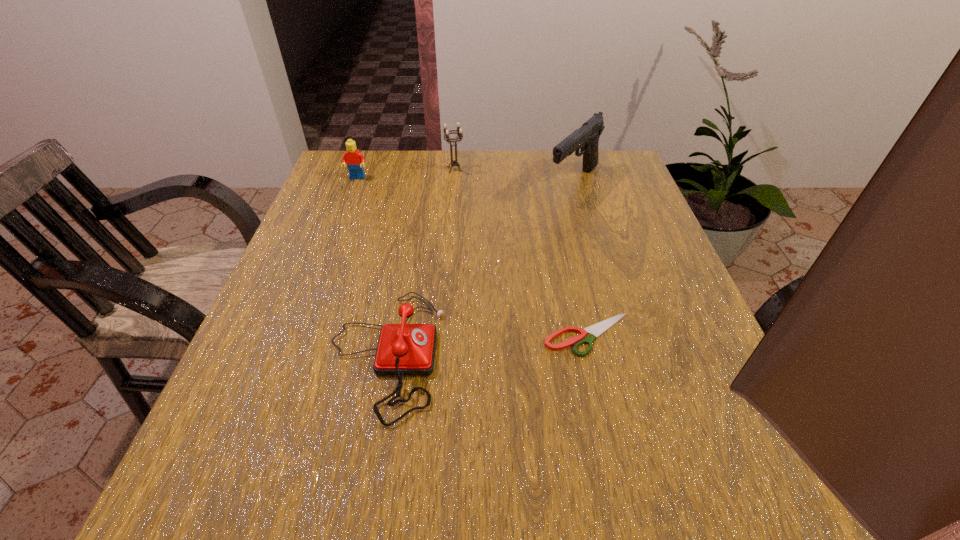
Image resolution: width=960 pixels, height=540 pixels. What are the coordinates of `vacant space at the far edge` in the screenshot? It's located at (431, 170).

Where is `blank space at the near edge of the desktop`? blank space at the near edge of the desktop is located at coordinates (563, 459).

Locate an element on the screen. The image size is (960, 540). free spot at the left edge of the desktop is located at coordinates (354, 227).

What are the coordinates of `vacant region at the right edge of the desktop` in the screenshot? It's located at (625, 352).

Locate an element on the screen. free spot between the third tallest object and the gun is located at coordinates (466, 180).

This screenshot has height=540, width=960. Identify the location of free point between the leftmost object and the gun. (466, 180).

The image size is (960, 540). I want to click on vacant space that is in between the scissors and the Lego, so click(x=472, y=256).

This screenshot has width=960, height=540. I want to click on free space between the telephone and the Lego, so click(x=372, y=266).

Where is `free space between the telephone and the Lego`? free space between the telephone and the Lego is located at coordinates (372, 266).

Find the location of a particular element. Image resolution: width=960 pixels, height=540 pixels. unoccupied position between the tallest object and the fourth tallest object is located at coordinates (479, 268).